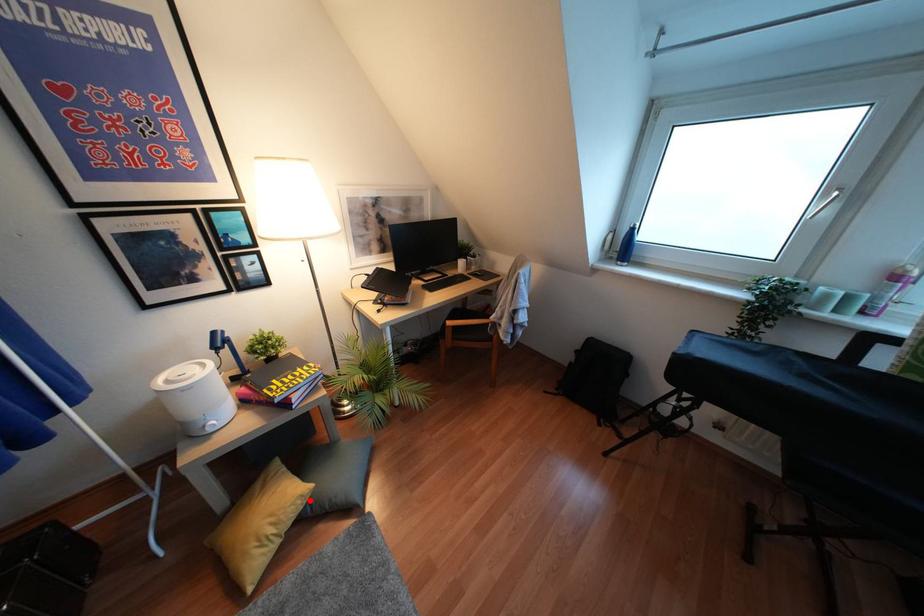
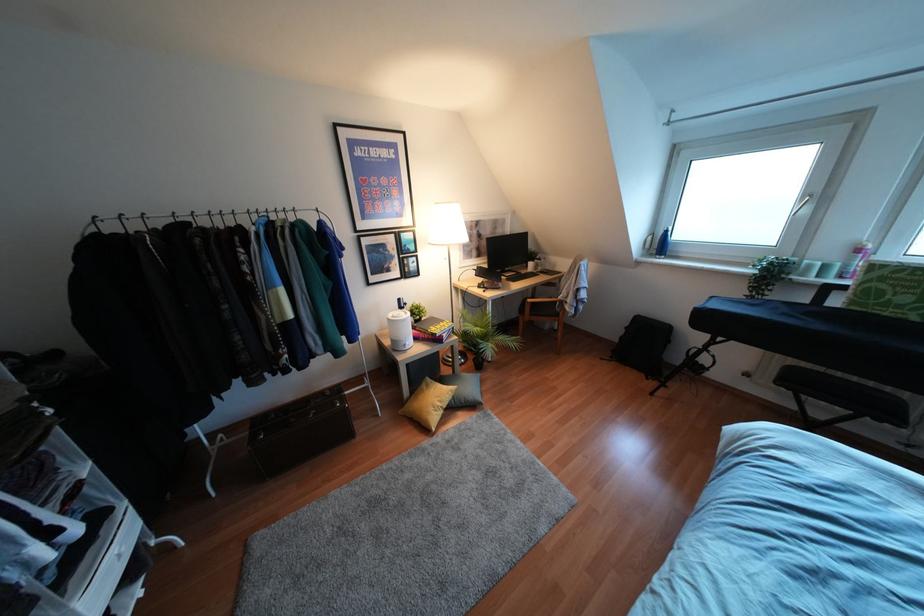
The point at the highlighted location is marked in the first image. Where is the corresponding point in the second image?

(453, 397)